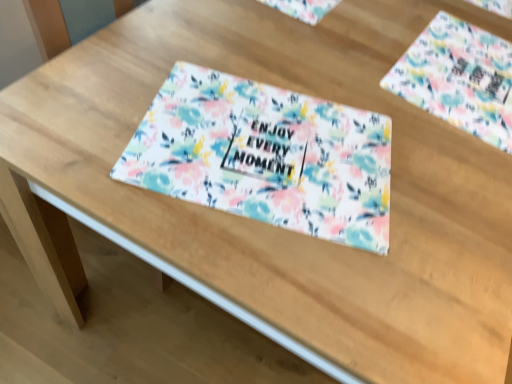
Locate an element on the screen. The width and height of the screenshot is (512, 384). vacant point to the left of floral fabric placemat at center is located at coordinates (101, 96).